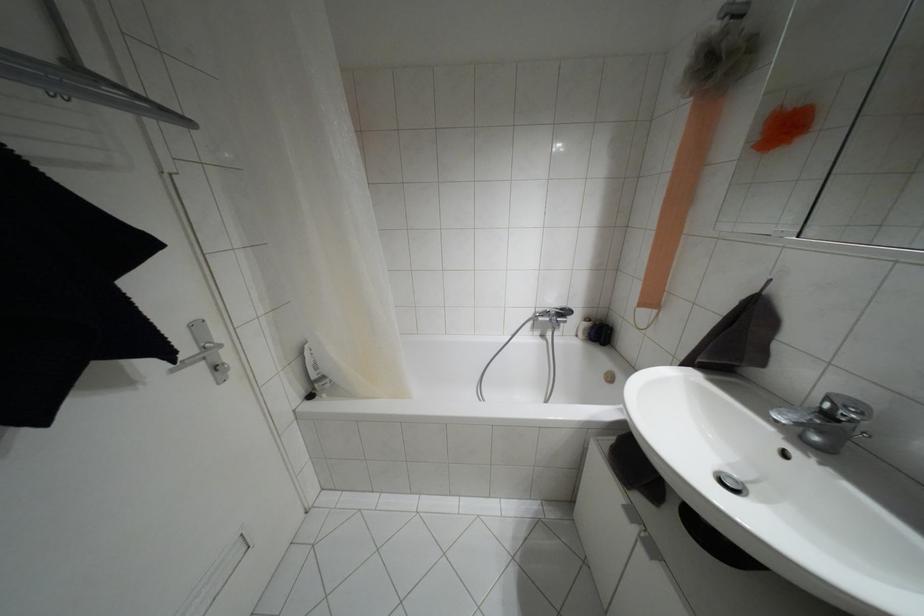
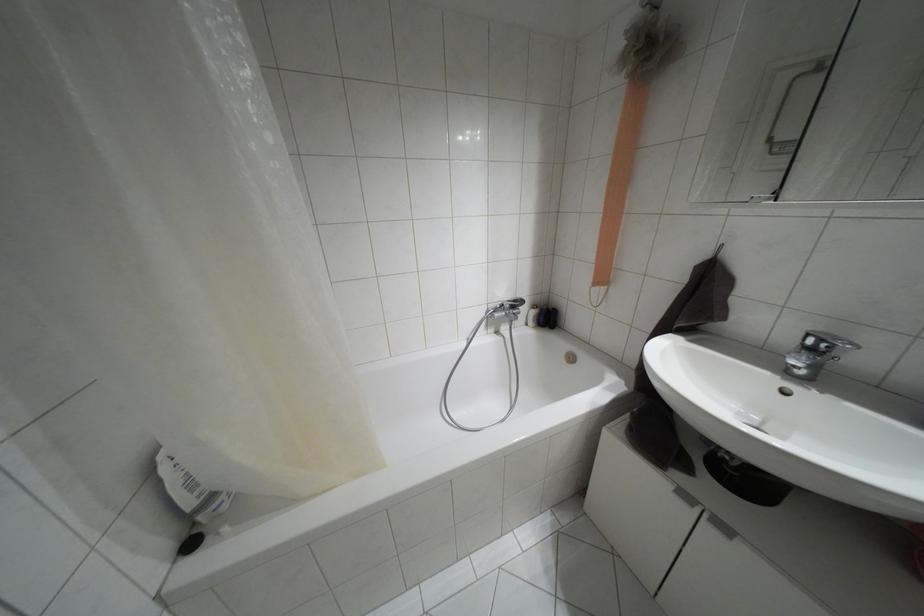
Locate, in the second image, the point that corresponds to point 631,513 in the first image.

(685, 496)